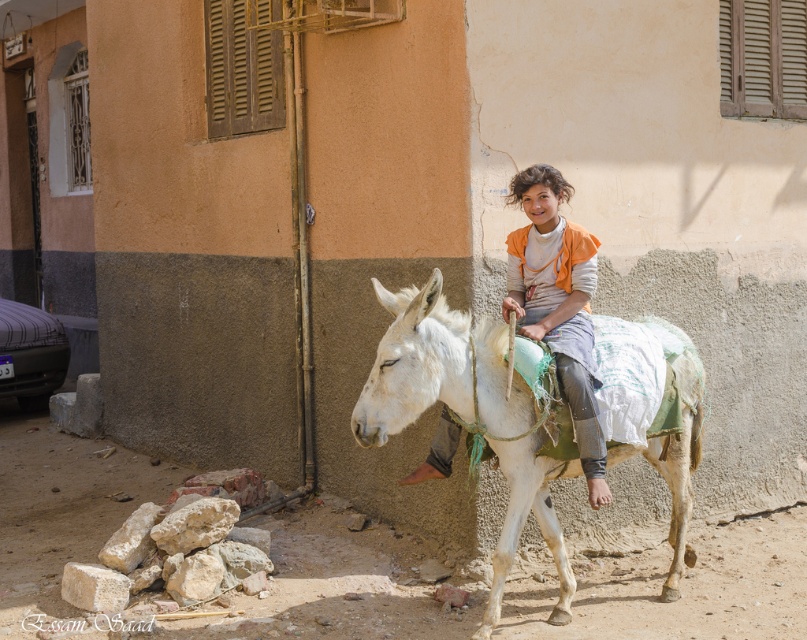
Can you confirm if orange fabric shirt at center is positioned to the left of metallic car at left?

Incorrect, orange fabric shirt at center is not on the left side of metallic car at left.

Is orange fabric shirt at center thinner than metallic car at left?

Yes, orange fabric shirt at center is thinner than metallic car at left.

The width and height of the screenshot is (807, 640). Find the location of `orange fabric shirt at center`. orange fabric shirt at center is located at coordinates (558, 304).

From the picture: Which is more to the left, white matte mule at center or metallic car at left?

Positioned to the left is metallic car at left.

Is white matte mule at center to the left of metallic car at left from the viewer's perspective?

In fact, white matte mule at center is to the right of metallic car at left.

At what (x,y) coordinates should I click in order to perform the action: click on white matte mule at center. Please return your answer as a coordinate pair (x, y). The image size is (807, 640). Looking at the image, I should click on (465, 417).

Can you confirm if white matte mule at center is shorter than orange fabric shirt at center?

Correct, white matte mule at center is not as tall as orange fabric shirt at center.

Does white matte mule at center appear under orange fabric shirt at center?

Correct, white matte mule at center is located below orange fabric shirt at center.

Between point (697, 392) and point (567, 364), which one is positioned in front?

Point (567, 364) is more forward.

Where is `white matte mule at center`? white matte mule at center is located at coordinates (465, 417).